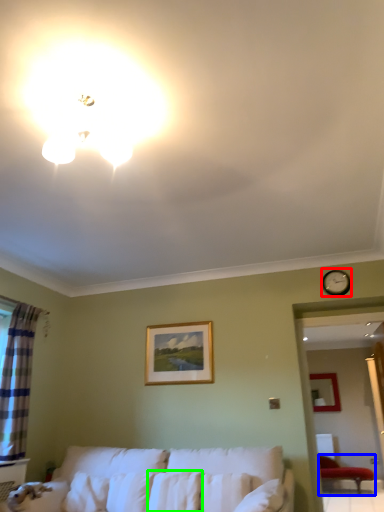
Question: Estimate the real-world distances between objects in this image. Which object is farther from clock (highlighted by a red box), furniture (highlighted by a blue box) or pillow (highlighted by a green box)?

Choices:
 (A) furniture
 (B) pillow

Answer: (A)